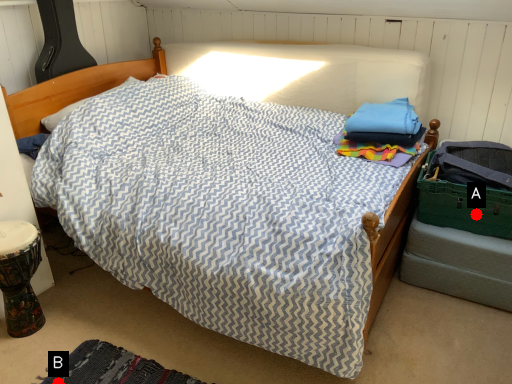
Question: Two points are circled on the image, labeled by A and B beside each circle. Among these points, which one is farthest from the camera?

Choices:
 (A) A is further
 (B) B is further

Answer: (A)